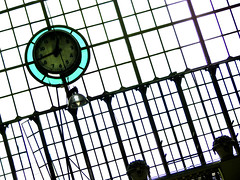
Find the location of a particular element. The image size is (240, 180). light is located at coordinates (81, 100).